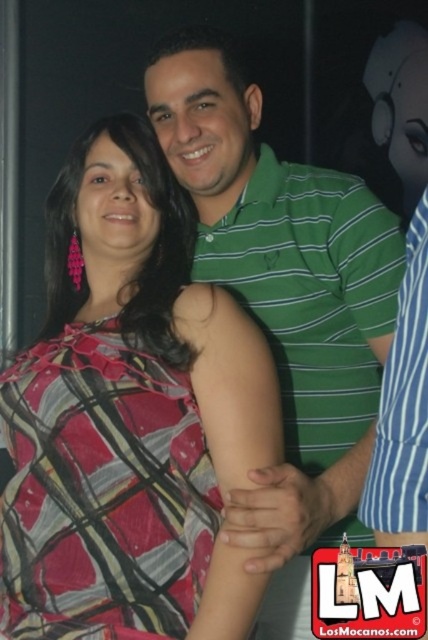
Who is shorter, plaid fabric dress at center or green striped shirt at right?

With less height is green striped shirt at right.

Is plaid fabric dress at center to the left of green striped shirt at right from the viewer's perspective?

Correct, you'll find plaid fabric dress at center to the left of green striped shirt at right.

This screenshot has height=640, width=428. Find the location of `plaid fabric dress at center`. plaid fabric dress at center is located at coordinates (130, 417).

Between plaid fabric dress at center and green striped polo shirt at center, which one is positioned lower?

plaid fabric dress at center

Can you confirm if plaid fabric dress at center is positioned below green striped polo shirt at center?

Yes.

Which is in front, point (220, 620) or point (291, 300)?

Point (220, 620) is in front.

Where is `plaid fabric dress at center`? This screenshot has height=640, width=428. plaid fabric dress at center is located at coordinates (130, 417).

Is green striped polo shirt at center positioned before green striped shirt at right?

No.

Who is taller, green striped polo shirt at center or green striped shirt at right?

green striped polo shirt at center

Measure the distance between point (237, 252) and camera.

Point (237, 252) and camera are 1.30 meters apart from each other.

Where is `green striped polo shirt at center`? green striped polo shirt at center is located at coordinates (285, 289).